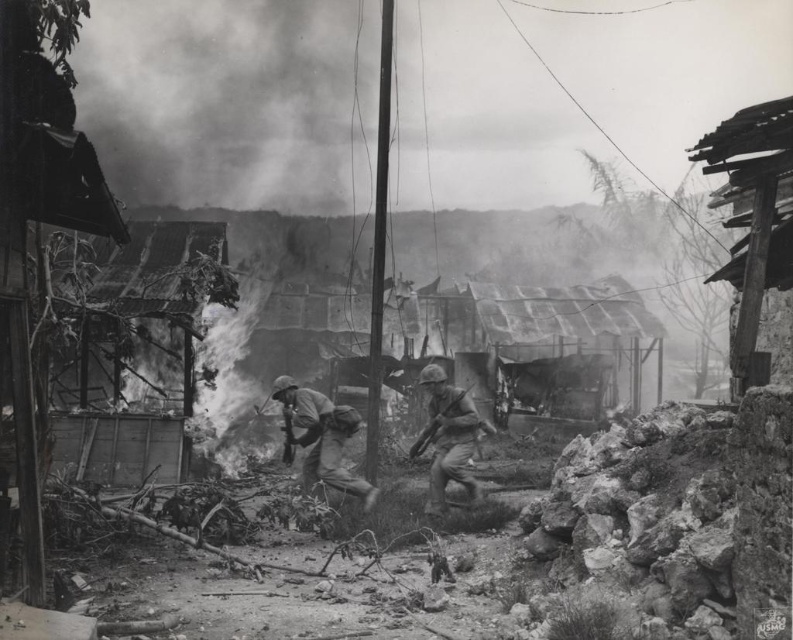
Question: Does rusty corrugated metal hut at right have a larger size compared to camouflage fabric uniform at center?

Choices:
 (A) no
 (B) yes

Answer: (B)

Question: Which object is positioned farthest from the camouflage fabric helmet at center?

Choices:
 (A) camouflage fabric uniform at center
 (B) rusty corrugated metal hut at right

Answer: (B)

Question: Is camouflage fabric uniform at center wider than camouflage fabric helmet at center?

Choices:
 (A) no
 (B) yes

Answer: (B)

Question: Which object is positioned closest to the camouflage fabric uniform at center?

Choices:
 (A) camouflage fabric helmet at center
 (B) rusty corrugated metal hut at right

Answer: (A)

Question: Based on their relative distances, which object is farther from the camouflage fabric uniform at center?

Choices:
 (A) camouflage fabric helmet at center
 (B) rusty corrugated metal hut at right

Answer: (B)

Question: Can you confirm if camouflage fabric uniform at center is positioned to the right of camouflage fabric helmet at center?

Choices:
 (A) no
 (B) yes

Answer: (A)